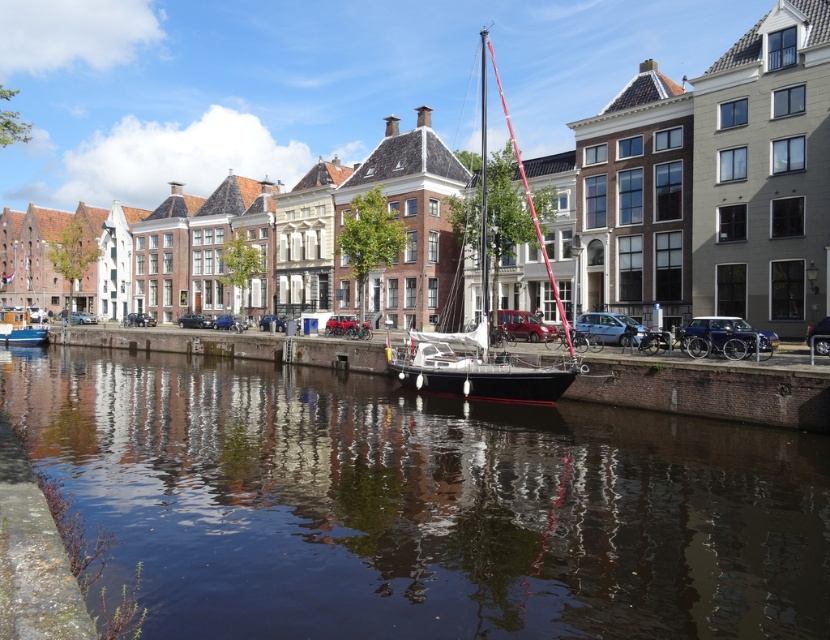
You are a tourist standing at the edge of the canal and you see two points marked in the image. The first point is at coordinate point [401,481] and the second is at point [484,189]. Which point is closer to you?

Point [401,481] is in front of point [484,189], so the first point is closer to you.

You are standing on the dock at the right side of the canal and want to reach the white sailboat at center. Which direction should you head towards to get there?

Since the white sailboat at center is located at point (479,259), you should head towards the center of the canal to reach it.

Consider the image. You are standing on the dock and looking at the smooth dark water at center and the matte blue boat at lower left. Which object takes up more space in the scene?

The smooth dark water at center takes up more space in the scene because it is bigger than the matte blue boat at lower left.